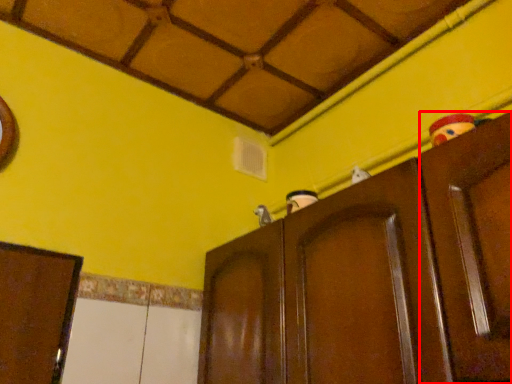
Question: From the image's perspective, where is door (annotated by the red box) located relative to cupboard?

Choices:
 (A) below
 (B) above

Answer: (B)